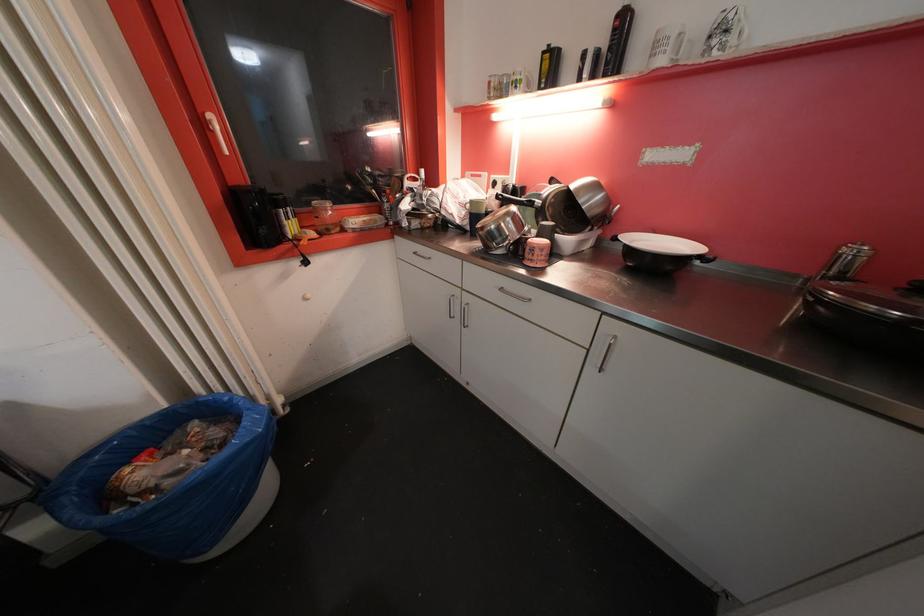
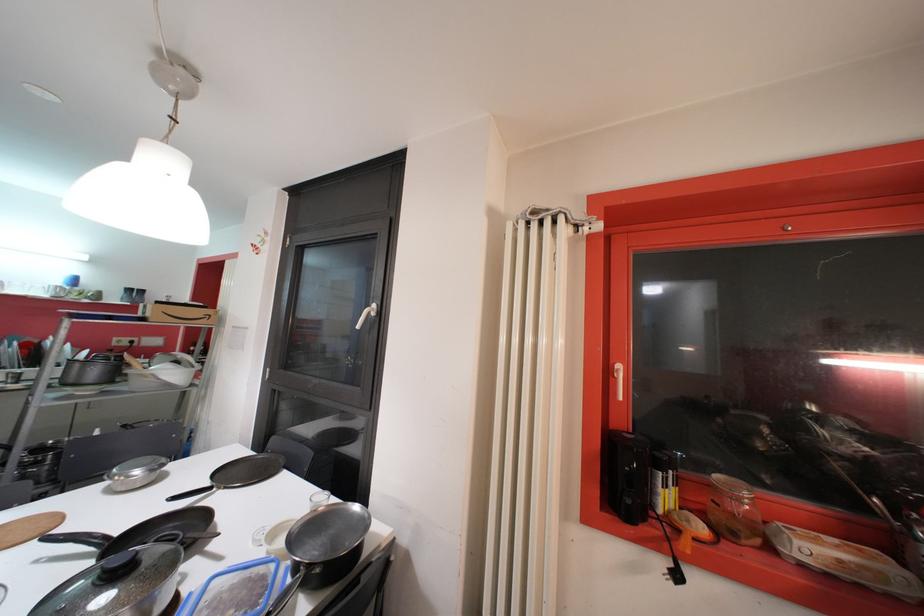
First-person continuous shooting, in which direction is the camera rotating?

The camera rotated toward left-up.